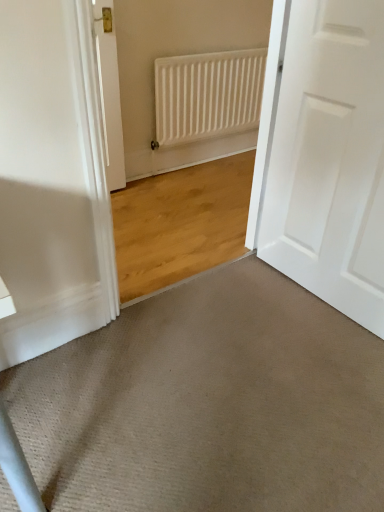
Identify the location of free area below white matte door at right (from a real-world perspective). (307, 294).